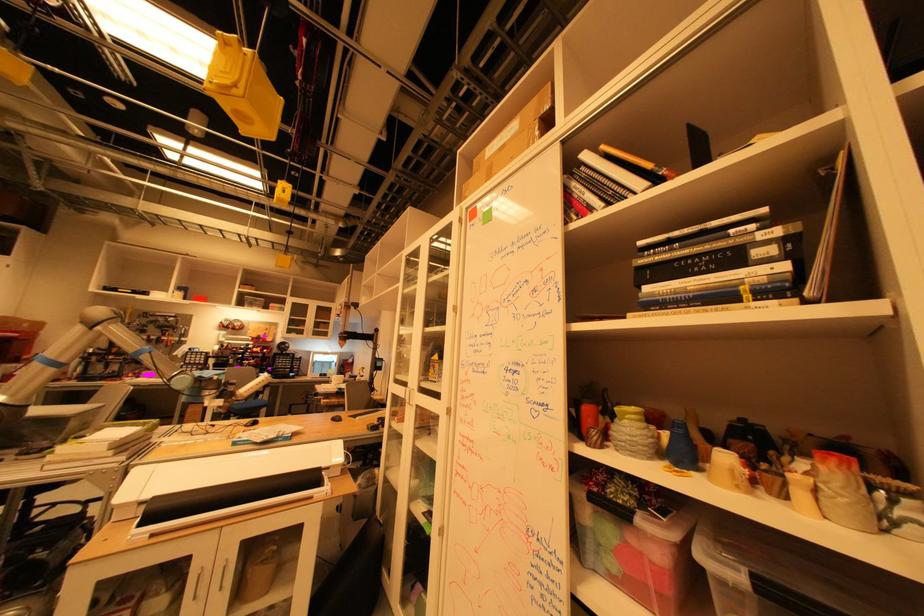
Find where to lift the grey textured vase. Please return your answer as a coordinate pair (x, y).

(681, 448)